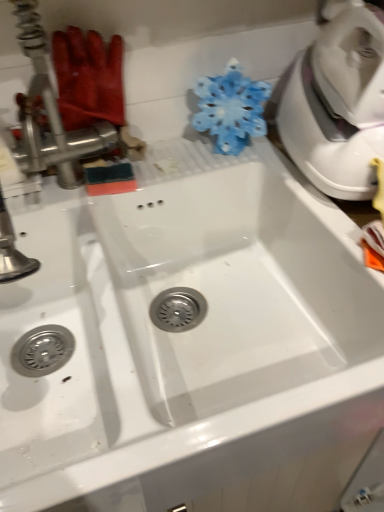
Question: Is metallic silver faucet at upper left taller or shorter than translucent plastic snowflake at upper center?

Choices:
 (A) short
 (B) tall

Answer: (B)

Question: Considering the positions of metallic silver faucet at upper left and translucent plastic snowflake at upper center in the image, is metallic silver faucet at upper left bigger or smaller than translucent plastic snowflake at upper center?

Choices:
 (A) big
 (B) small

Answer: (B)

Question: Is metallic silver faucet at upper left inside the boundaries of translucent plastic snowflake at upper center, or outside?

Choices:
 (A) outside
 (B) inside

Answer: (A)

Question: Considering the positions of translucent plastic snowflake at upper center and metallic silver faucet at upper left in the image, is translucent plastic snowflake at upper center taller or shorter than metallic silver faucet at upper left?

Choices:
 (A) short
 (B) tall

Answer: (A)

Question: Would you say translucent plastic snowflake at upper center is to the left or to the right of metallic silver faucet at upper left in the picture?

Choices:
 (A) left
 (B) right

Answer: (B)

Question: From the image's perspective, is translucent plastic snowflake at upper center positioned above or below metallic silver faucet at upper left?

Choices:
 (A) above
 (B) below

Answer: (B)

Question: Which is correct: translucent plastic snowflake at upper center is inside metallic silver faucet at upper left, or outside of it?

Choices:
 (A) inside
 (B) outside

Answer: (B)